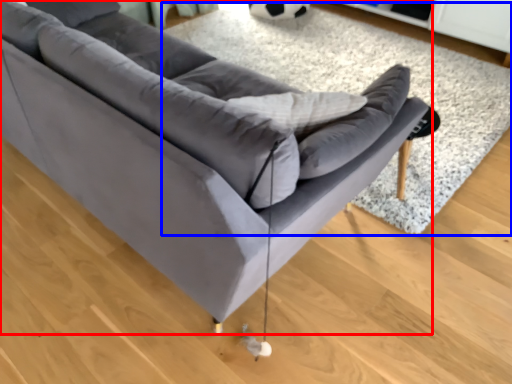
Question: Which of the following is the closest to the observer, studio couch (highlighted by a red box) or mat (highlighted by a blue box)?

Choices:
 (A) studio couch
 (B) mat

Answer: (A)